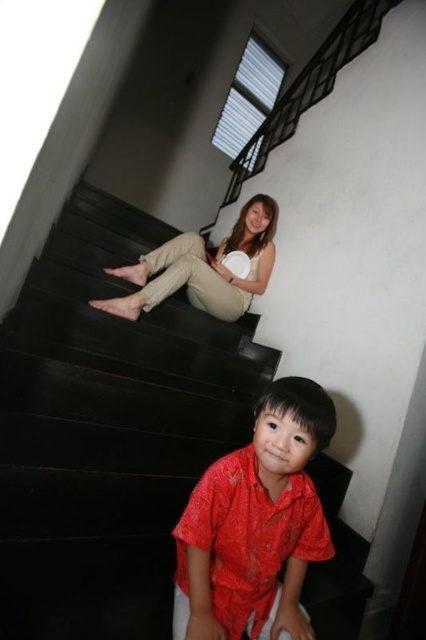
Can you confirm if matte red shirt at lower center is taller than beige cotton pants at center?

No, matte red shirt at lower center is not taller than beige cotton pants at center.

The width and height of the screenshot is (426, 640). Describe the element at coordinates (256, 524) in the screenshot. I see `matte red shirt at lower center` at that location.

Find the location of a particular element. The height and width of the screenshot is (640, 426). matte red shirt at lower center is located at coordinates (256, 524).

Does black glossy stairs at upper center come behind matte red shirt at lower center?

That is False.

Looking at this image, who is more distant from viewer, [66,497] or [279,502]?

The point [66,497] is more distant.

Where is `black glossy stairs at upper center`? This screenshot has height=640, width=426. black glossy stairs at upper center is located at coordinates (108, 432).

Locate an element on the screen. The width and height of the screenshot is (426, 640). black glossy stairs at upper center is located at coordinates (108, 432).

Who is more distant from viewer, (152,432) or (100,300)?

The point (100,300) is more distant.

Find the location of a particular element. This screenshot has height=640, width=426. black glossy stairs at upper center is located at coordinates (108, 432).